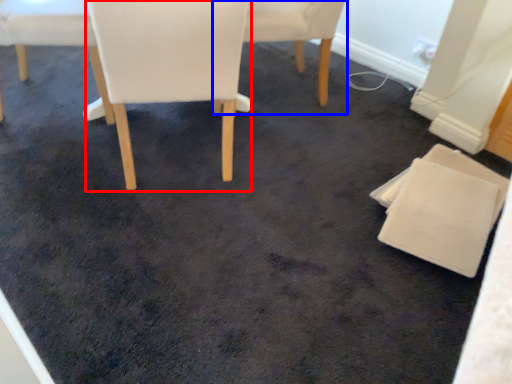
Question: Which point is further to the camera, chair (highlighted by a red box) or chair (highlighted by a blue box)?

Choices:
 (A) chair
 (B) chair

Answer: (B)